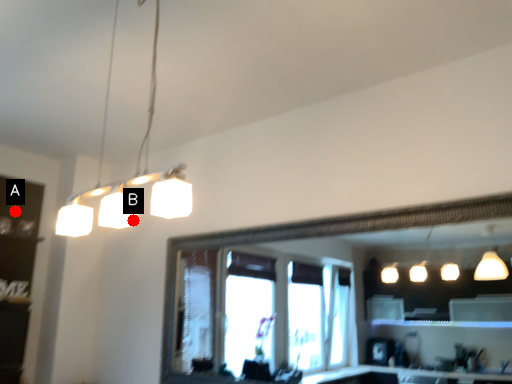
Question: Two points are circled on the image, labeled by A and B beside each circle. Which point is closer to the camera taking this photo?

Choices:
 (A) A is closer
 (B) B is closer

Answer: (A)